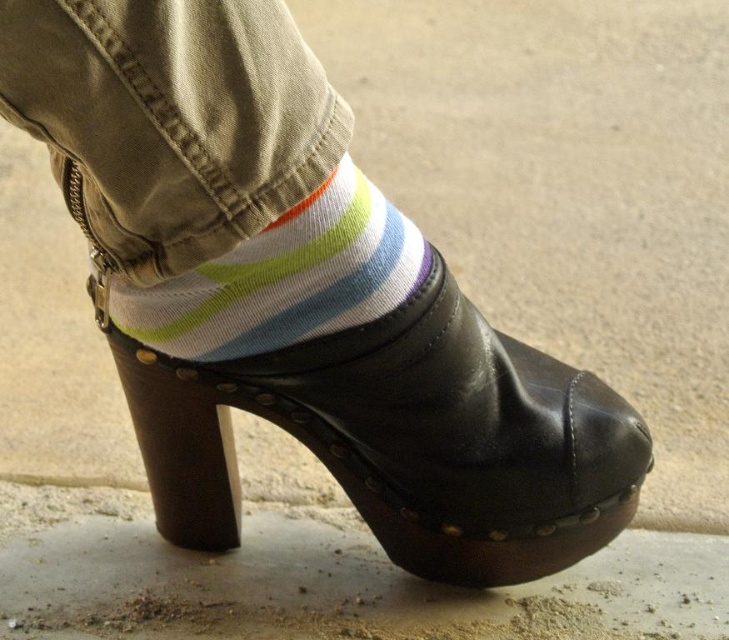
Who is positioned more to the right, black leather clog at center or white striped sock at center?

Answer: From the viewer's perspective, black leather clog at center appears more on the right side.

Between point (467, 472) and point (235, 275), which one is positioned behind?

The point (467, 472) is more distant.

Find the location of a particular element. The width and height of the screenshot is (729, 640). black leather clog at center is located at coordinates (402, 438).